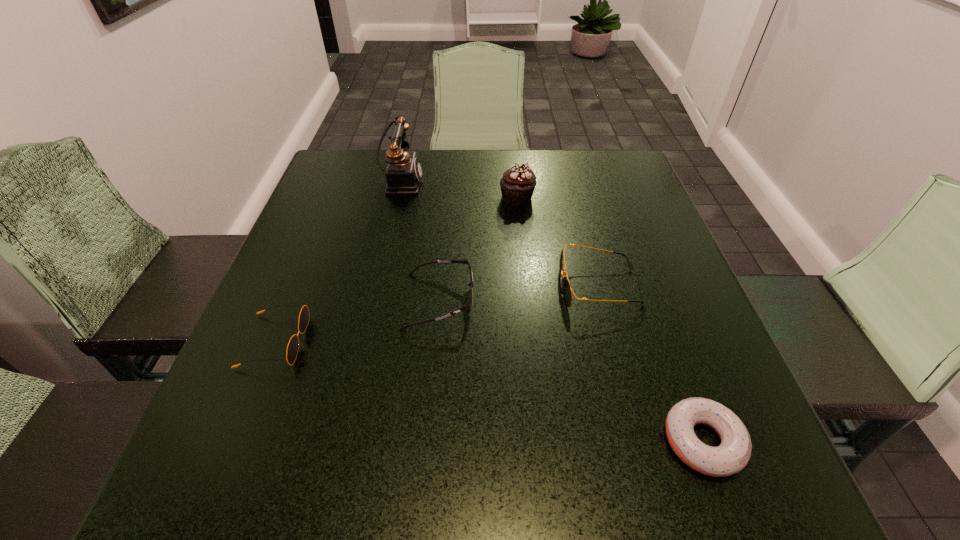
The width and height of the screenshot is (960, 540). I want to click on blank space at the near right corner of the desktop, so click(x=690, y=507).

This screenshot has width=960, height=540. In order to click on free space that is in between the leftmost sunglasses and the second sunglasses from right to left in this screenshot , I will do `click(357, 321)`.

Where is `unoccupied area between the second sunglasses from left to right and the fourth object from left to right`? The width and height of the screenshot is (960, 540). unoccupied area between the second sunglasses from left to right and the fourth object from left to right is located at coordinates (478, 249).

You are a GUI agent. You are given a task and a screenshot of the screen. Output one action in this format:
    pyautogui.click(x=<x>, y=<y>)
    Task: Click on the free area in between the second sunglasses from left to right and the doughnut
    The height and width of the screenshot is (540, 960).
    Given the screenshot: What is the action you would take?
    pyautogui.click(x=571, y=371)

Where is `empty location between the tallest object and the fifth shortest object`? The height and width of the screenshot is (540, 960). empty location between the tallest object and the fifth shortest object is located at coordinates (459, 190).

The image size is (960, 540). What are the coordinates of `vacant area that lies between the telephone and the second sunglasses from right to left` in the screenshot? It's located at (420, 241).

This screenshot has width=960, height=540. In order to click on vacant point located between the rightmost sunglasses and the leftmost sunglasses in this screenshot , I will do `click(437, 314)`.

Where is `free space between the leftmost sunglasses and the doughnut`? The width and height of the screenshot is (960, 540). free space between the leftmost sunglasses and the doughnut is located at coordinates (489, 391).

Where is `unoccupied position between the doughnut and the tallest object`? The image size is (960, 540). unoccupied position between the doughnut and the tallest object is located at coordinates (552, 311).

The image size is (960, 540). Identify the location of vacant space that's between the third object from right to left and the second sunglasses from left to right. (478, 249).